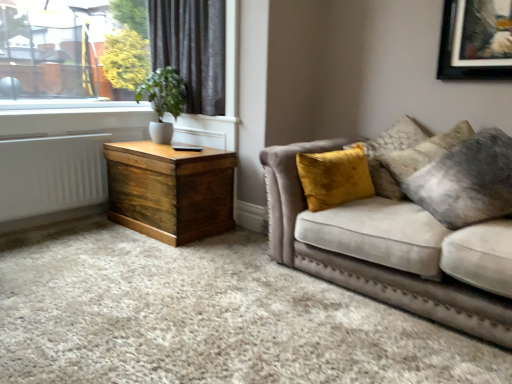
Locate an element on the screen. This screenshot has width=512, height=384. vacant region above white painted radiator at left (from a real-world perspective) is located at coordinates (33, 140).